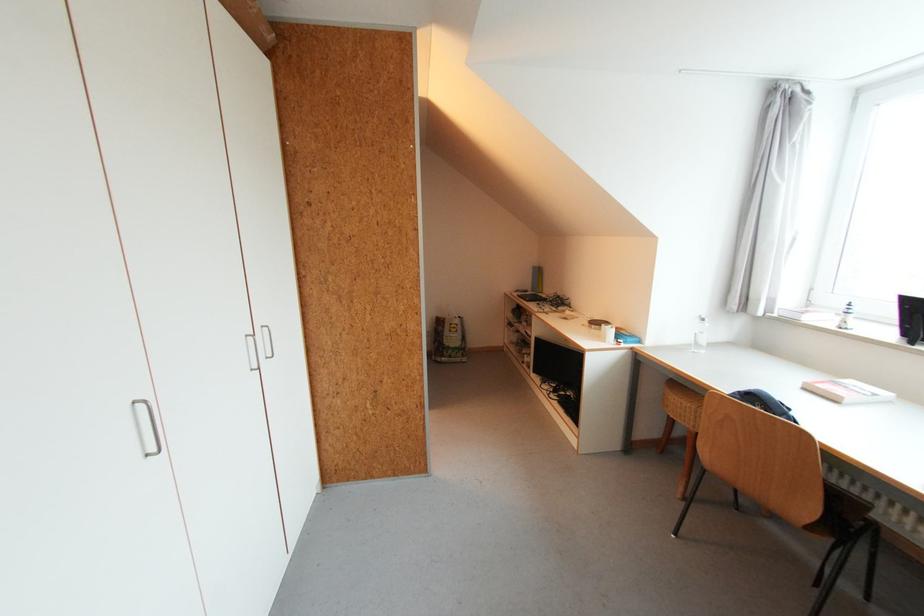
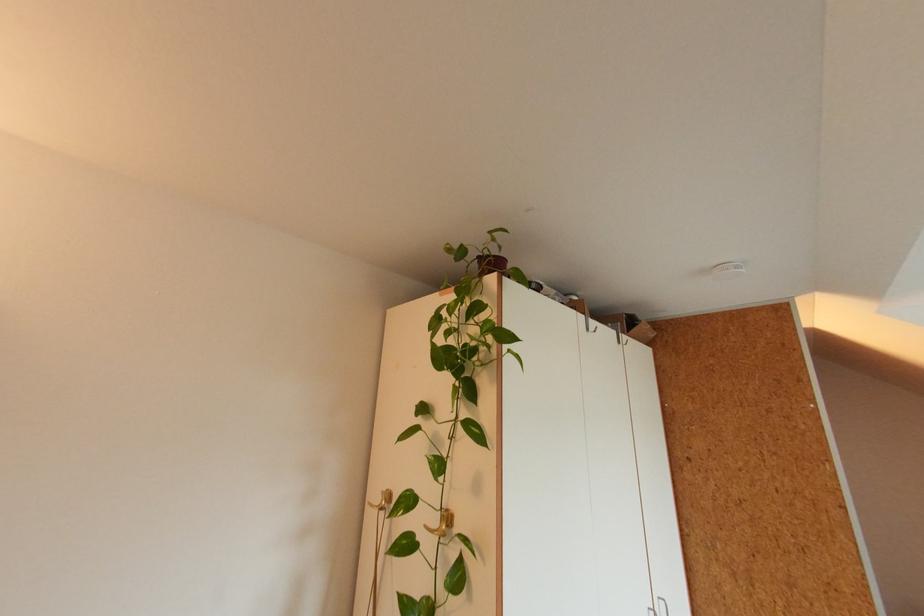
Based on the continuous images, in which direction is the camera rotating?

The camera rotated toward left-up.